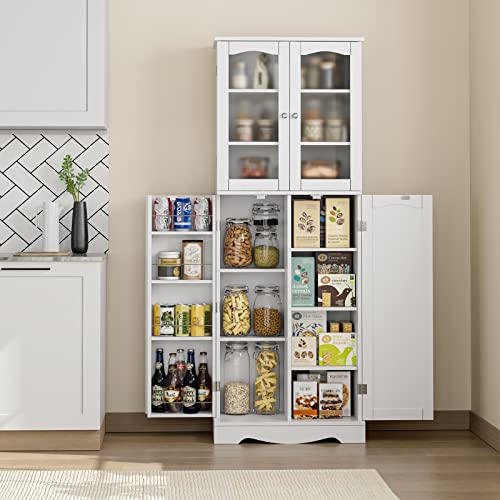
Locate an element on the screen. The image size is (500, 500). items behind frosted glass is located at coordinates (243, 82), (265, 80), (312, 76), (333, 78), (337, 130), (316, 131), (269, 133), (245, 133), (257, 162), (330, 165).